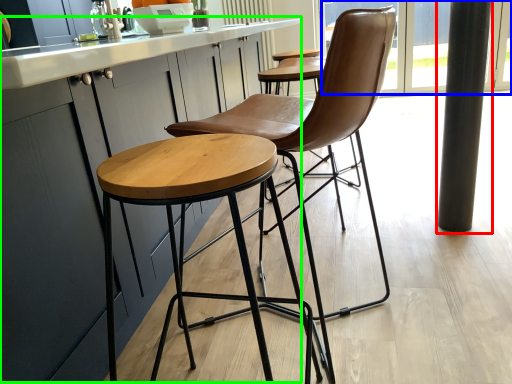
Question: Which object is positioned farthest from pillar (highlighted by a red box)? Select from window screen (highlighted by a blue box) and counter top (highlighted by a green box).

Choices:
 (A) window screen
 (B) counter top

Answer: (A)